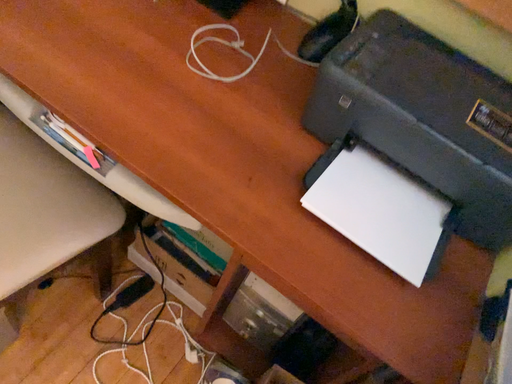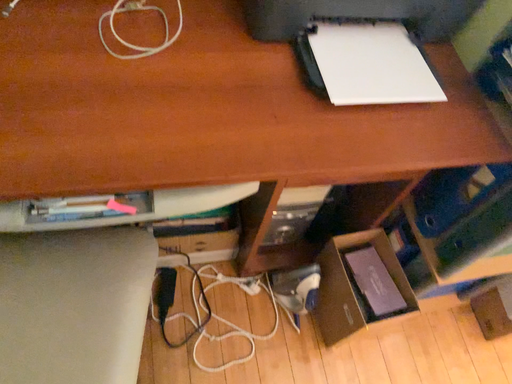
Question: Which way did the camera rotate in the video?

Choices:
 (A) rotated left
 (B) rotated right

Answer: (B)